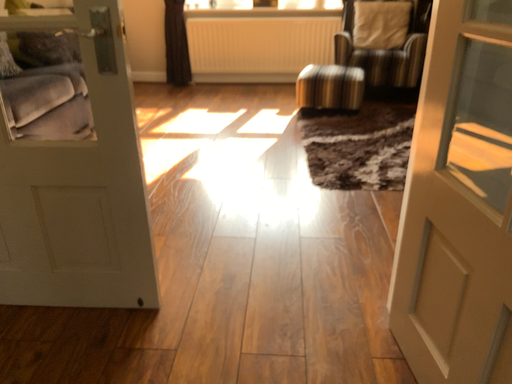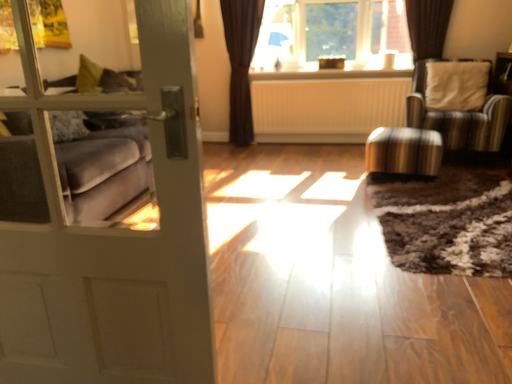
Question: Which way did the camera rotate in the video?

Choices:
 (A) rotated left
 (B) rotated right

Answer: (A)